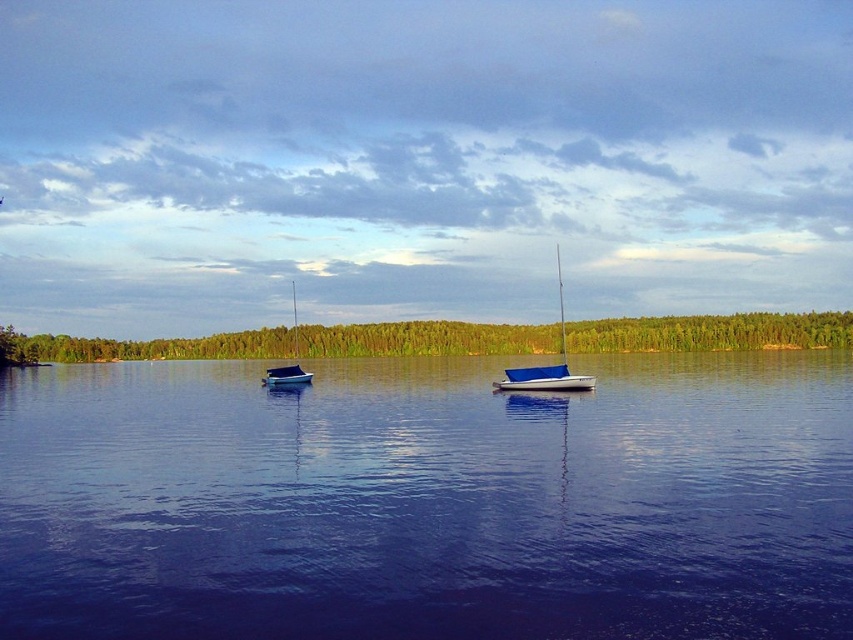
You are standing at the edge of the lake and want to locate the blue water at center. According to the coordinates provided, in which direction should you look relative to your position?

The blue water at center is located at coordinates point (428, 500), so you should look towards the center of the image to find it.

From the picture: You are planning to take a short boat ride on the lake. You see two sailboats available for rent, the blue canvas sailboat at center and the blue matte sailboat at center. Which one would you choose if you want the bigger one?

The blue canvas sailboat at center is larger in size than the blue matte sailboat at center, so you should choose the blue canvas sailboat at center for a bigger boat.

You are standing on the lakeside dock and see the blue water at center and the blue canvas sailboat at center. Which object is positioned to the left of the other?

The blue water at center is to the left of blue canvas sailboat at center.